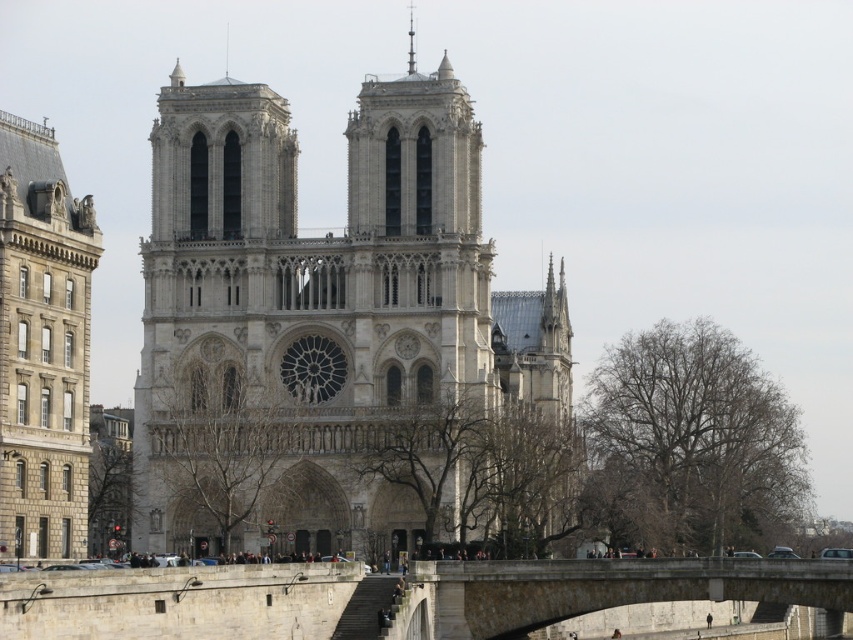
You are standing at the point marked as point (611, 588) and want to cross the gray stone bridge at lower center. Is the gray stone bridge at lower center directly in front of you?

The gray stone bridge at lower center is located at point (611, 588), so yes, the gray stone bridge at lower center is directly in front of you.

You are standing in front of Notre Dame Cathedral and want to take a photo that includes the gray stone tower at left. Based on its position, where should you aim your camera to ensure the tower is centered in the frame?

To center the gray stone tower at left in your photo, aim your camera at the coordinates specified by the point location of the tower, which is at 2D location point [42,346].

You are an architect analyzing the Notre Dame Cathedral layout. You observe the gray stone tower at left and the gray stone bridge at lower center in the image. Which structure takes up more visual area in the scene?

The gray stone bridge at lower center occupies more space than the gray stone tower at left, so it takes up more visual area in the scene.